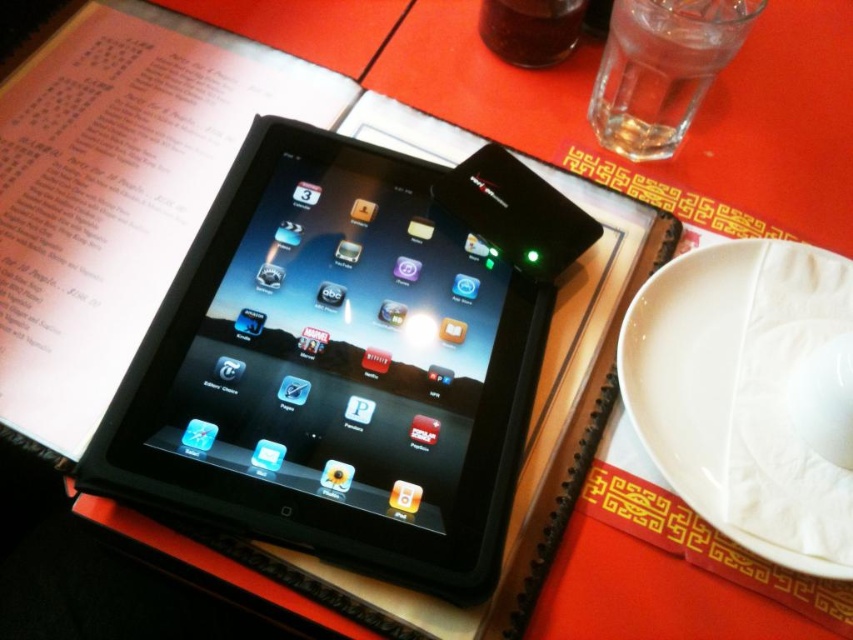
You are a server at a restaurant and need to place a napkin on the table. The napkin is the same size as the clear glass water at upper right. Will it fit on the white matte plate at lower right?

The white matte plate at lower right is larger in size than the clear glass water at upper right, so the napkin will fit on the white matte plate at lower right since it is bigger than the napkin.

You are a server in a restaurant and need to place a new menu on the table. The menu is 10cm tall. You see the white matte plate at lower right and clear glass water at upper right. Can you place the menu between them without moving either object?

The white matte plate at lower right is positioned under the clear glass water at upper right, meaning there is no space between them for the menu. Therefore, you cannot place the menu between them without moving either object.

You are a waiter in a busy restaurant and need to quickly serve a customer. You see the white matte plate at lower right and the transparent glass at upper center on the table. Which item is closer to you as you approach the table from the front?

The white matte plate at lower right is closer to you because it is in front of the transparent glass at upper center, meaning it is positioned nearer to your viewpoint when approaching from the front.